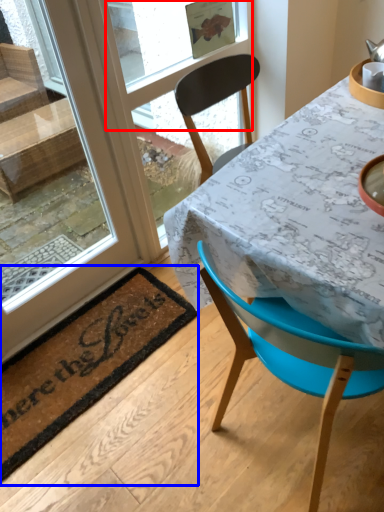
Question: Which object is further to the camera taking this photo, window screen (highlighted by a red box) or mat (highlighted by a blue box)?

Choices:
 (A) window screen
 (B) mat

Answer: (A)